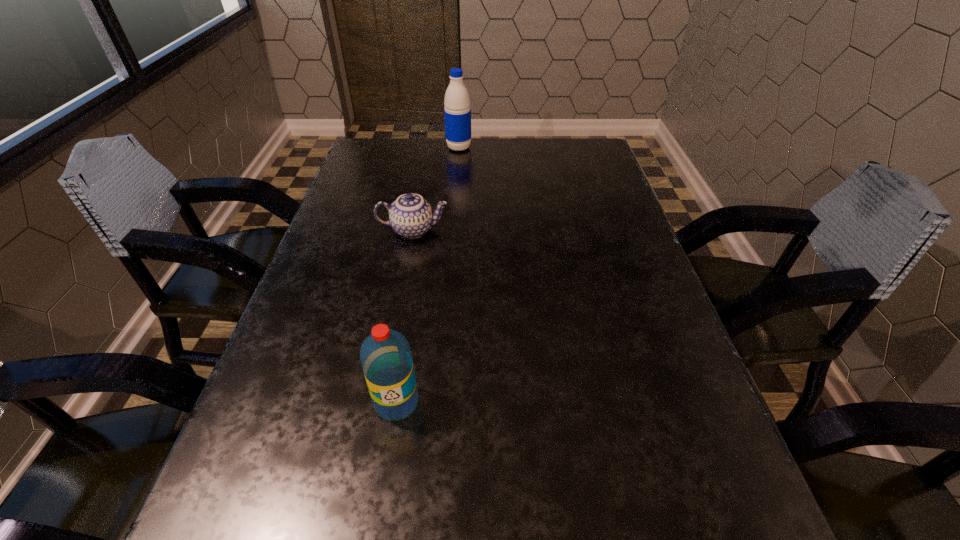
Find the location of a particular element. object at the left edge is located at coordinates (411, 216).

You are a GUI agent. You are given a task and a screenshot of the screen. Output one action in this format:
    pyautogui.click(x=<x>, y=<y>)
    Task: Click on the blank space at the far edge
    The width and height of the screenshot is (960, 540).
    Given the screenshot: What is the action you would take?
    pyautogui.click(x=418, y=142)

The image size is (960, 540). I want to click on vacant region at the left edge of the desktop, so click(x=326, y=307).

The image size is (960, 540). In order to click on blank space at the right edge of the desktop in this screenshot , I will do `click(592, 320)`.

Identify the location of free space at the far right corner of the desktop. (562, 148).

Where is `vacant space in between the nearer water bottle and the chinaware`? vacant space in between the nearer water bottle and the chinaware is located at coordinates (405, 316).

Find the location of a particular element. vacant region between the tallest object and the shortest object is located at coordinates (436, 189).

Image resolution: width=960 pixels, height=540 pixels. I want to click on vacant space in between the chinaware and the farthest object, so click(x=436, y=189).

Where is `vacant area that lies between the chinaware and the nearest object`? This screenshot has height=540, width=960. vacant area that lies between the chinaware and the nearest object is located at coordinates (405, 316).

I want to click on vacant area between the nearest object and the farthest object, so click(428, 275).